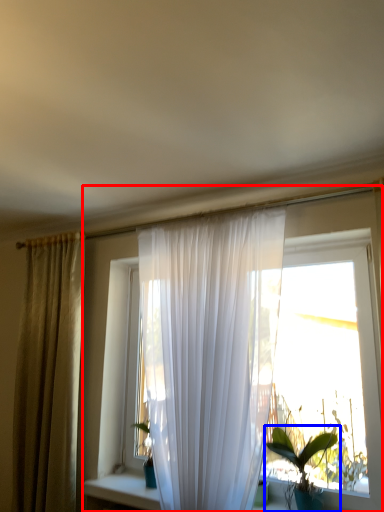
Question: Which point is further to the camera, window (highlighted by a red box) or houseplant (highlighted by a blue box)?

Choices:
 (A) window
 (B) houseplant

Answer: (B)